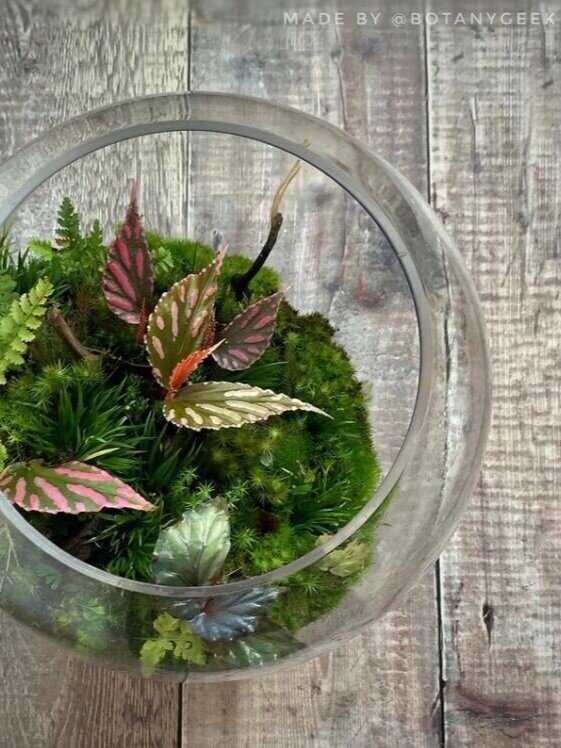
At what (x,y) coordinates should I click in order to perform the action: click on wood plank. Please return your answer as a coordinate pair (x, y). The height and width of the screenshot is (748, 561). Looking at the image, I should click on coord(519,595).